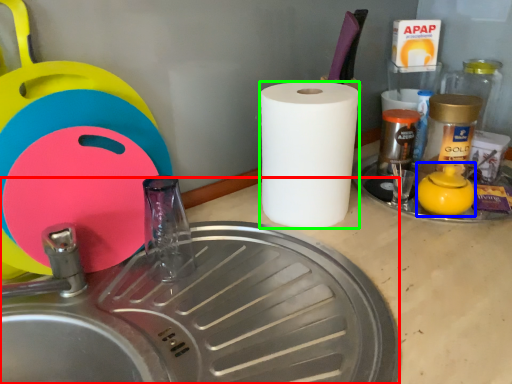
Question: Based on their relative distances, which object is farther from sink (highlighted by a red box)? Choose from tea pot (highlighted by a blue box) and paper towel (highlighted by a green box).

Choices:
 (A) tea pot
 (B) paper towel

Answer: (A)